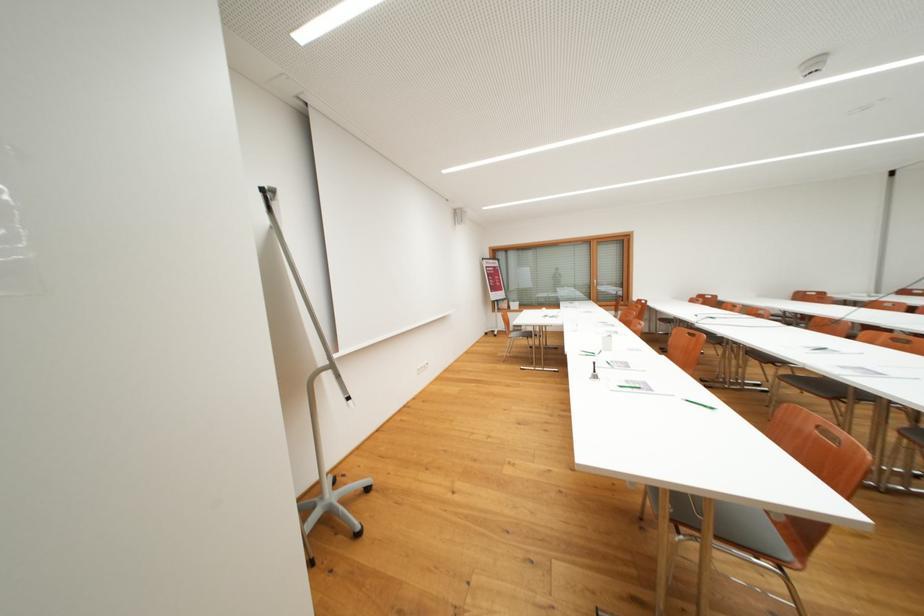
Where would you squeez the white bottle? Please return your answer as a coordinate pair (x, y).

(763, 363)